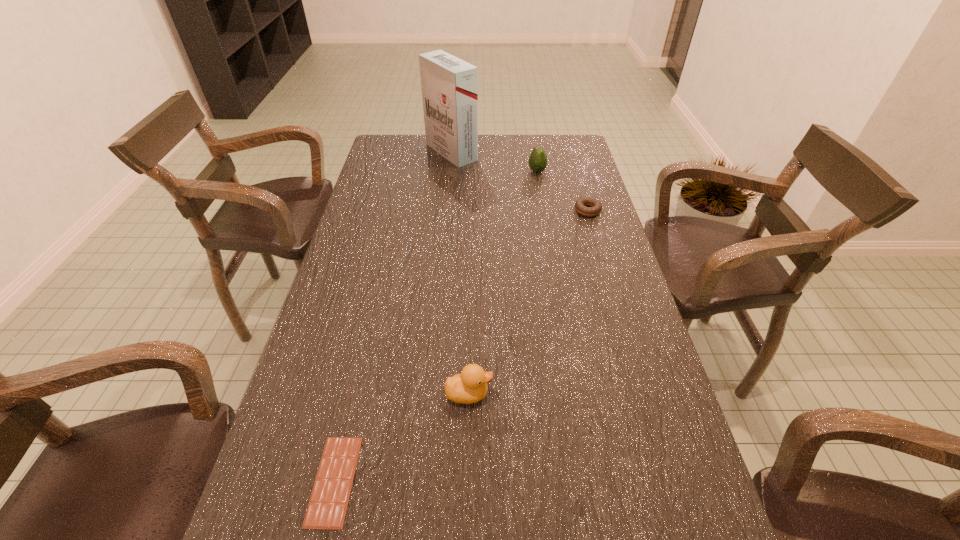
The height and width of the screenshot is (540, 960). Identify the location of the tallest object. (449, 85).

Locate an element on the screen. the second object from right to left is located at coordinates (537, 162).

The width and height of the screenshot is (960, 540). What are the coordinates of `the second nearest object` in the screenshot? It's located at (469, 386).

At what (x,y) coordinates should I click in order to perform the action: click on the third nearest object. Please return your answer as a coordinate pair (x, y). This screenshot has height=540, width=960. Looking at the image, I should click on (595, 207).

I want to click on the fourth tallest object, so click(595, 207).

At what (x,y) coordinates should I click in order to perform the action: click on the shortest object. Please return your answer as a coordinate pair (x, y). Image resolution: width=960 pixels, height=540 pixels. Looking at the image, I should click on (327, 507).

You are a GUI agent. You are given a task and a screenshot of the screen. Output one action in this format:
    pyautogui.click(x=<x>, y=<y>)
    Task: Click on the chocolate bar
    This screenshot has width=960, height=540.
    Given the screenshot: What is the action you would take?
    pyautogui.click(x=327, y=507)

The image size is (960, 540). I want to click on vacant area situated on the right of the tallest object, so click(496, 152).

In order to click on vacant space located on the right of the avocado in this screenshot , I will do `click(560, 172)`.

What are the coordinates of `vacant space located 0.150m on the face of the duckling` in the screenshot? It's located at (562, 394).